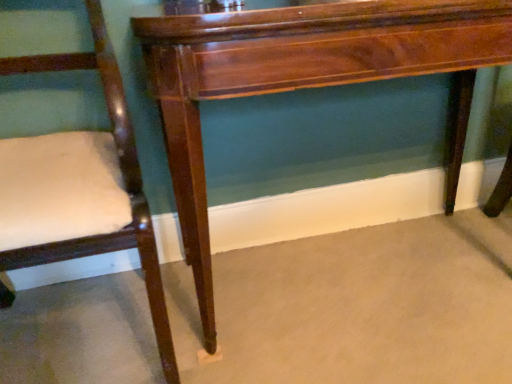
Describe the element at coordinates (120, 185) in the screenshot. The width and height of the screenshot is (512, 384). I see `matte wood chair at left` at that location.

Identify the location of matte wood chair at left. 120,185.

What is the approximate height of matte wood chair at left?

It is 73.33 centimeters.

Describe the element at coordinates (305, 79) in the screenshot. I see `mahogany wood table at center` at that location.

You are a GUI agent. You are given a task and a screenshot of the screen. Output one action in this format:
    pyautogui.click(x=<x>, y=<y>)
    Task: Click on the mahogany wood table at center
    The height and width of the screenshot is (384, 512).
    Given the screenshot: What is the action you would take?
    pyautogui.click(x=305, y=79)

Measure the distance between point [455,141] and camera.

The distance of point [455,141] from camera is 4.19 feet.

This screenshot has width=512, height=384. I want to click on matte wood chair at left, so click(120, 185).

Which object is positioned more to the left, mahogany wood table at center or matte wood chair at left?

Positioned to the left is matte wood chair at left.

Consider the image. Which is behind, mahogany wood table at center or matte wood chair at left?

Positioned behind is mahogany wood table at center.

Is point (196, 192) closer or farther from the camera than point (105, 95)?

Clearly, point (196, 192) is closer to the camera than point (105, 95).

From the image's perspective, which one is positioned lower, mahogany wood table at center or matte wood chair at left?

matte wood chair at left.

From a real-world perspective, which object stands above the other?

From a 3D spatial view, matte wood chair at left is above.

Consider the image. Considering the sizes of mahogany wood table at center and matte wood chair at left in the image, is mahogany wood table at center wider or thinner than matte wood chair at left?

Considering their sizes, mahogany wood table at center looks slimmer than matte wood chair at left.

Who is shorter, mahogany wood table at center or matte wood chair at left?

Standing shorter between the two is mahogany wood table at center.

Is mahogany wood table at center bigger or smaller than matte wood chair at left?

mahogany wood table at center is bigger than matte wood chair at left.

Based on the photo, choose the correct answer: Is mahogany wood table at center inside matte wood chair at left or outside it?

mahogany wood table at center exists outside the volume of matte wood chair at left.

From the picture: Is mahogany wood table at center in contact with matte wood chair at left?

They are not placed beside each other.

Is mahogany wood table at center positioned with its back to matte wood chair at left?

No, mahogany wood table at center's orientation is not away from matte wood chair at left.

How many degrees apart are the facing directions of mahogany wood table at center and matte wood chair at left?

0.777 degrees separate the facing orientations of mahogany wood table at center and matte wood chair at left.

Identify the location of table located underneath the matte wood chair at left (from a real-world perspective). point(305,79).

Between matte wood chair at left and mahogany wood table at center, which one appears on the right side from the viewer's perspective?

mahogany wood table at center is more to the right.

In the image, is matte wood chair at left positioned in front of or behind mahogany wood table at center?

Visually, matte wood chair at left is located in front of mahogany wood table at center.

Considering the points (110, 61) and (344, 33), which point is in front, point (110, 61) or point (344, 33)?

The point (344, 33) is closer to the camera.

From the image's perspective, would you say matte wood chair at left is positioned over mahogany wood table at center?

Actually, matte wood chair at left appears below mahogany wood table at center in the image.

From a real-world perspective, which is physically below, matte wood chair at left or mahogany wood table at center?

From a 3D spatial view, mahogany wood table at center is below.

Looking at their sizes, would you say matte wood chair at left is wider or thinner than mahogany wood table at center?

In the image, matte wood chair at left appears to be wider than mahogany wood table at center.

Is matte wood chair at left taller than mahogany wood table at center?

Yes, matte wood chair at left is taller than mahogany wood table at center.

Considering the sizes of matte wood chair at left and mahogany wood table at center in the image, is matte wood chair at left bigger or smaller than mahogany wood table at center?

Result: Considering their sizes, matte wood chair at left takes up less space than mahogany wood table at center.

From the picture: Is matte wood chair at left situated inside mahogany wood table at center or outside?

matte wood chair at left is outside mahogany wood table at center.

Consider the image. Would you say matte wood chair at left is a long distance from mahogany wood table at center?

No.

Is matte wood chair at left oriented towards mahogany wood table at center?

No, matte wood chair at left is not turned towards mahogany wood table at center.

In order to click on table on the right side of matte wood chair at left in this screenshot , I will do `click(305, 79)`.

Locate an element on the screen. table above the matte wood chair at left (from the image's perspective) is located at coordinates (305, 79).

Where is `chair below the mahogany wood table at center (from the image's perspective)`? chair below the mahogany wood table at center (from the image's perspective) is located at coordinates [120, 185].